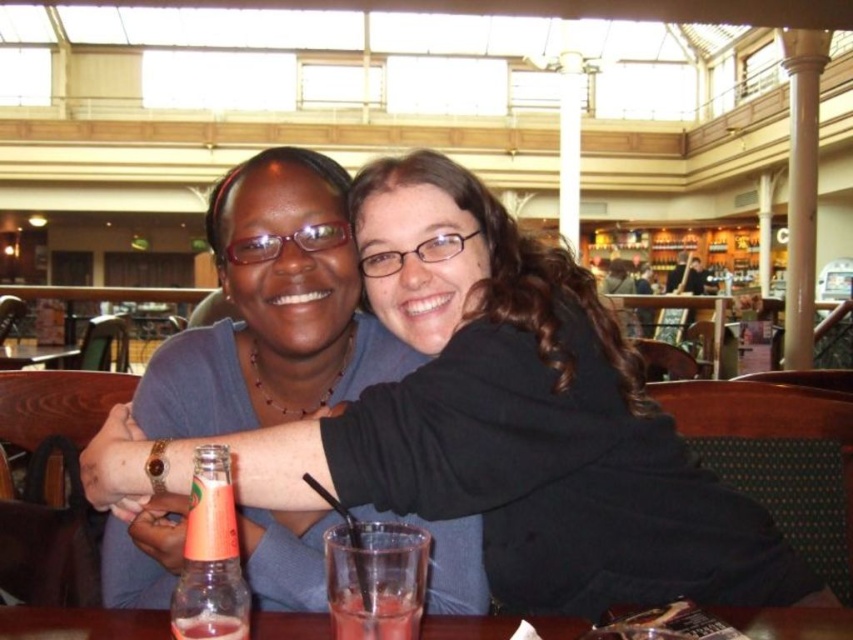
Can you confirm if transparent glass at lower center is positioned to the right of translucent glass beverage at table front?

Indeed, transparent glass at lower center is positioned on the right side of translucent glass beverage at table front.

Is transparent glass at lower center thinner than translucent glass beverage at table front?

No, transparent glass at lower center is not thinner than translucent glass beverage at table front.

Is point (267, 616) in front of point (224, 621)?

No.

The height and width of the screenshot is (640, 853). I want to click on transparent glass at lower center, so click(x=80, y=624).

Is point (364, 605) more distant than point (349, 604)?

No, (364, 605) is in front of (349, 604).

Between point (413, 616) and point (352, 625), which one is positioned in front?

Point (352, 625) is more forward.

This screenshot has width=853, height=640. Find the location of `translucent glass at table center`. translucent glass at table center is located at coordinates (375, 579).

Who is more forward, (369,536) or (198,576)?

Point (198,576)

Find the location of `translucent glass at table center`. translucent glass at table center is located at coordinates (375, 579).